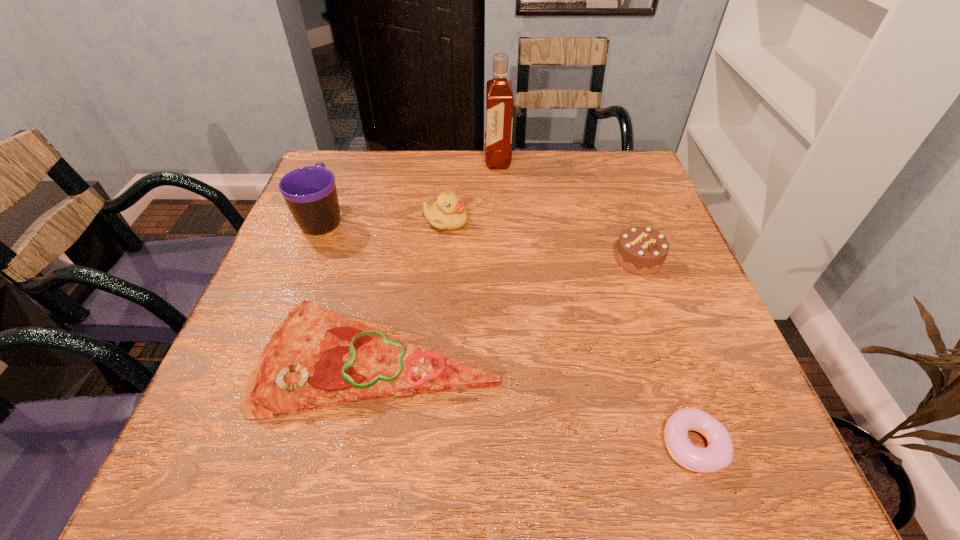
Image resolution: width=960 pixels, height=540 pixels. I want to click on vacant region that satisfies the following two spatial constraints: 1. on the front label of the liquor; 2. on the front side of the fifth tallest object, so click(508, 359).

The height and width of the screenshot is (540, 960). In order to click on free space in the image that satisfies the following two spatial constraints: 1. on the front label of the doughnut; 2. on the right side of the farthest object in this screenshot , I will do `click(513, 444)`.